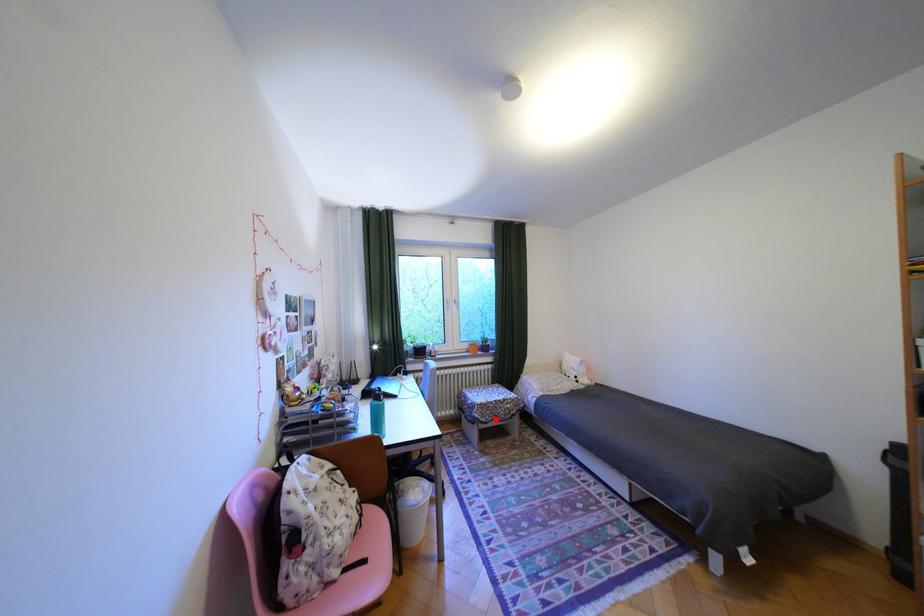
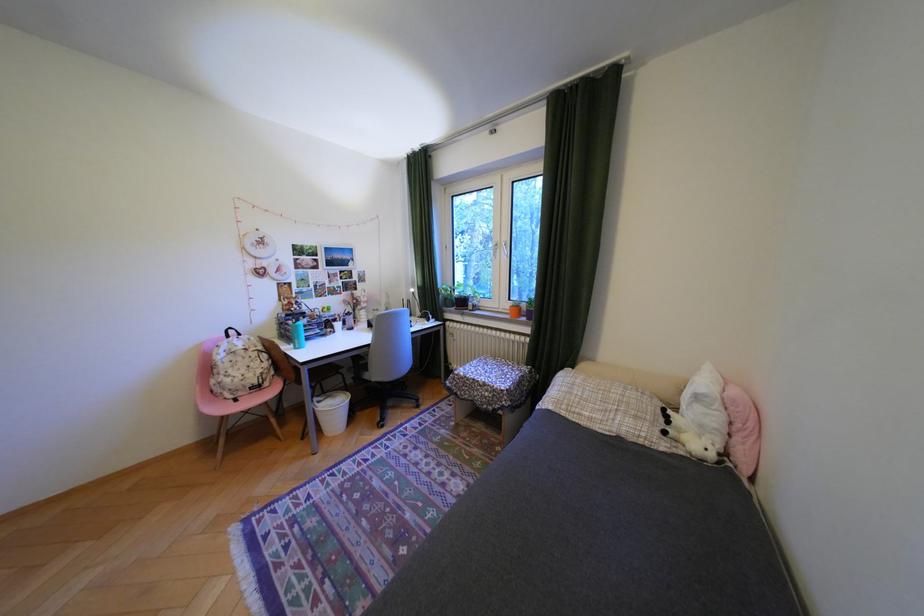
Locate, in the second image, the point that corresponds to the highlighted location in the first image.

(470, 392)